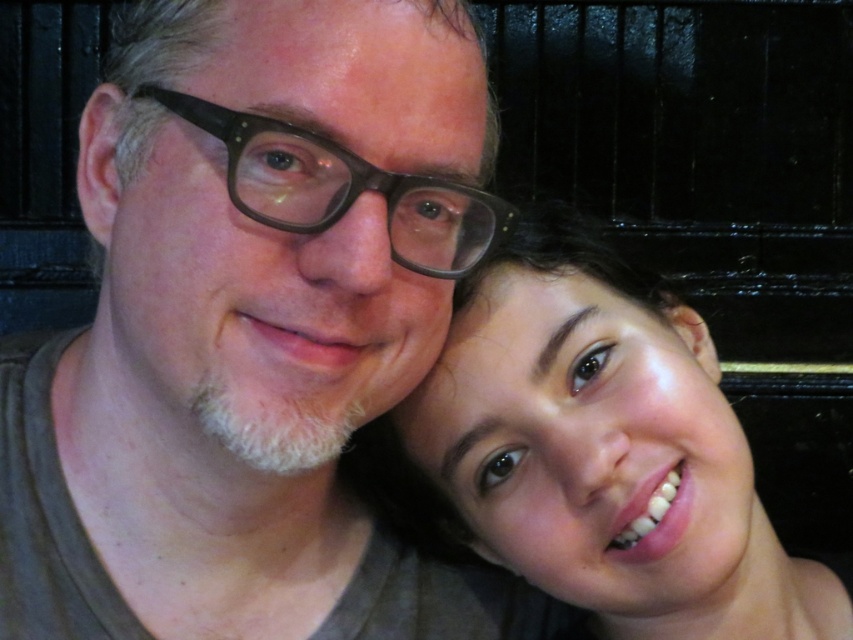
Question: Which of these objects is positioned farthest from the smooth skin face at center?

Choices:
 (A) matte brown hair at center
 (B) matte brown glasses at center

Answer: (B)

Question: Does matte brown hair at center have a lesser width compared to smooth skin face at center?

Choices:
 (A) no
 (B) yes

Answer: (A)

Question: Is smooth skin face at center wider than matte brown glasses at center?

Choices:
 (A) yes
 (B) no

Answer: (A)

Question: Which point is farther from the camera taking this photo?

Choices:
 (A) (426, 266)
 (B) (422, 620)
 (C) (750, 614)

Answer: (B)

Question: In this image, where is matte brown hair at center located relative to matte brown glasses at center?

Choices:
 (A) right
 (B) left

Answer: (B)

Question: Which object is positioned farthest from the smooth skin face at center?

Choices:
 (A) matte brown glasses at center
 (B) matte brown hair at center

Answer: (A)